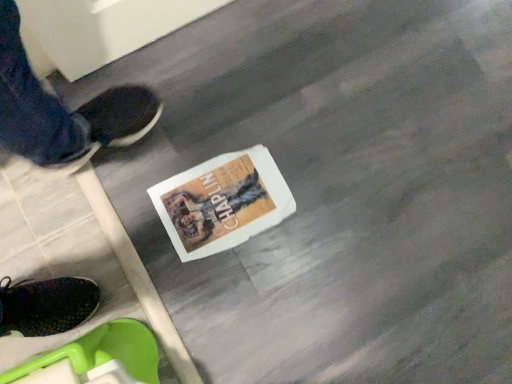
This screenshot has width=512, height=384. What are the coordinates of `vacant space that is to the left of white paper magazine at center` in the screenshot? It's located at (143, 172).